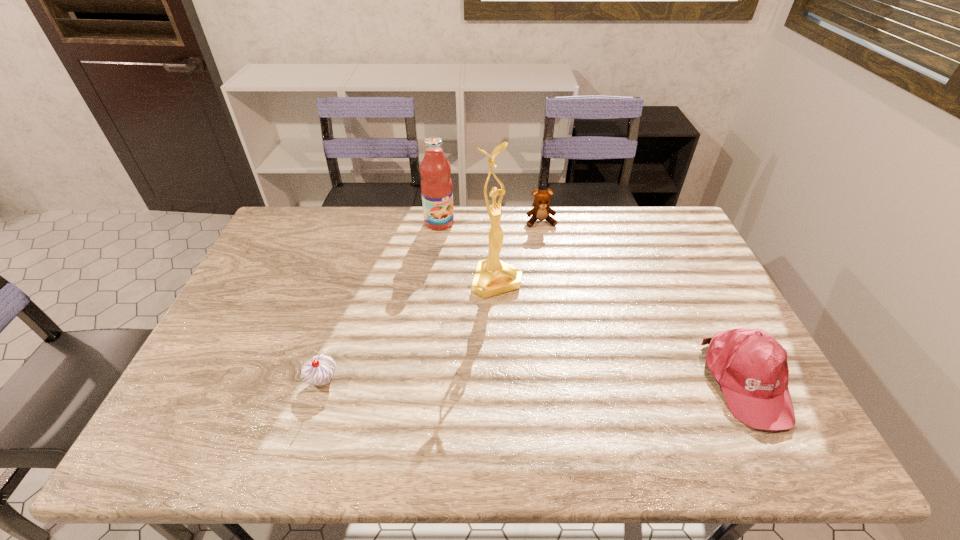
In order to click on object identified as the closest to the cupcake in this screenshot , I will do `click(492, 277)`.

This screenshot has height=540, width=960. I want to click on free space that satisfies the following two spatial constraints: 1. on the back side of the leftmost object; 2. on the right side of the third object from right to left, so click(353, 280).

Image resolution: width=960 pixels, height=540 pixels. Identify the location of vacant space that satisfies the following two spatial constraints: 1. on the back side of the fourth object from left to right; 2. on the right side of the third nearest object. (494, 222).